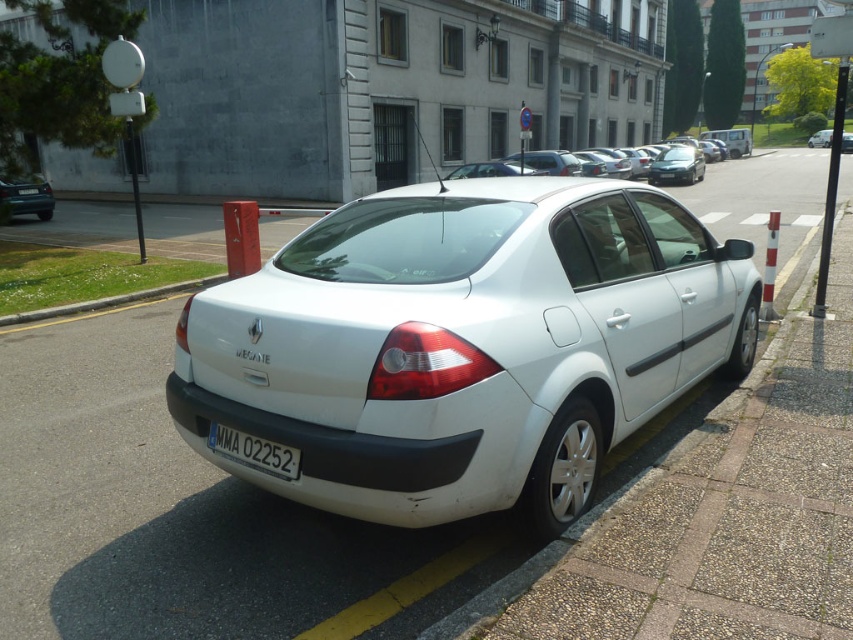
Question: Can you confirm if white matte sedan at center is thinner than satin black sedan at center?

Choices:
 (A) yes
 (B) no

Answer: (B)

Question: Estimate the real-world distances between objects in this image. Which object is farther from the white matte sedan at center?

Choices:
 (A) matte black car at left
 (B) black plastic license plate at lower center
 (C) satin black sedan at center

Answer: (A)

Question: Which of the following is the farthest from the observer?

Choices:
 (A) matte black car at left
 (B) black plastic license plate at lower center
 (C) satin black sedan at center

Answer: (C)

Question: Is black plastic license plate at lower center to the right of matte black car at left from the viewer's perspective?

Choices:
 (A) no
 (B) yes

Answer: (B)

Question: Does white matte sedan at center have a smaller size compared to black plastic license plate at lower center?

Choices:
 (A) no
 (B) yes

Answer: (A)

Question: Which object is positioned closest to the matte black car at left?

Choices:
 (A) satin black sedan at center
 (B) white matte sedan at center
 (C) black plastic license plate at lower center

Answer: (C)